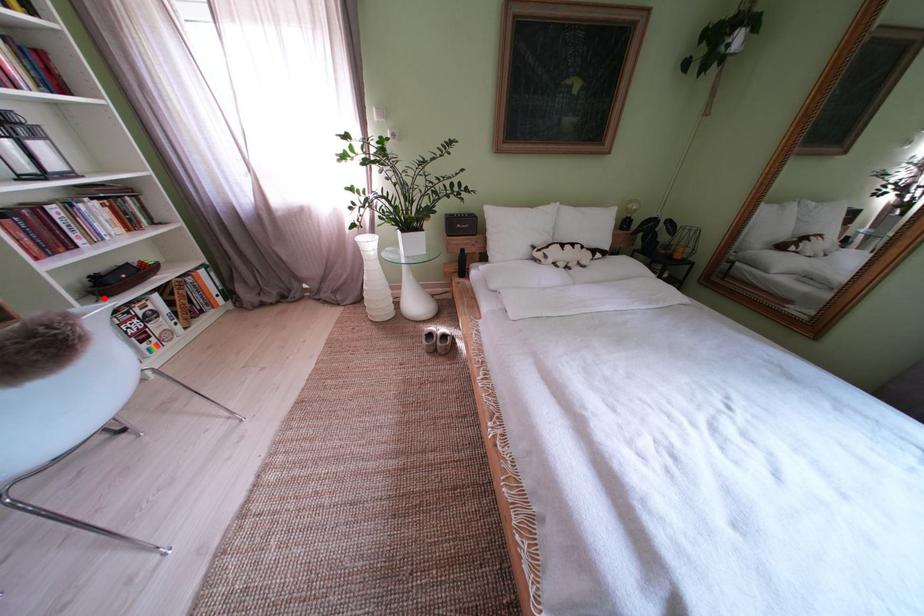
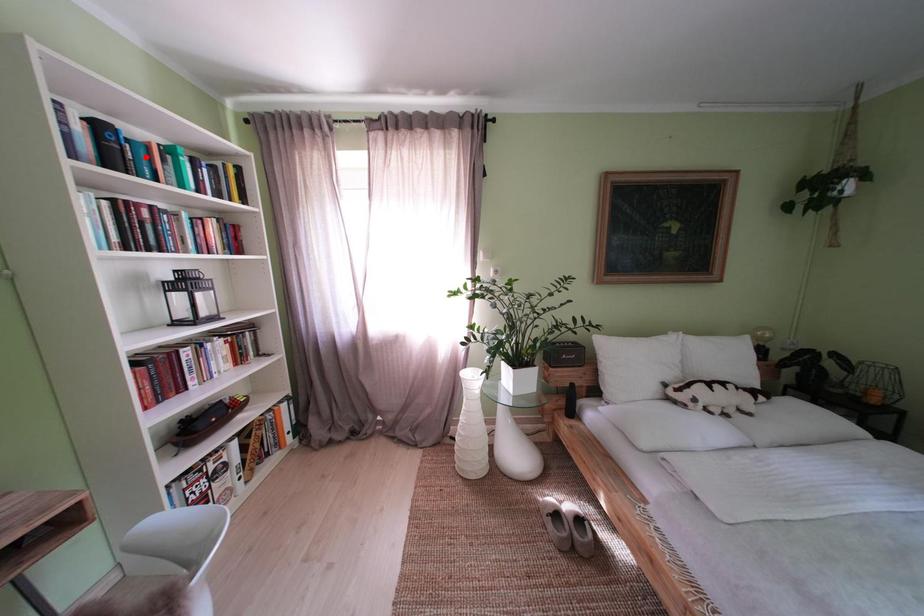
I am providing you with two images of the same scene from different viewpoints. A red point is marked on the first image and another point is marked on the second image. Is the marked point in image1 the same physical position as the marked point in image2?

No